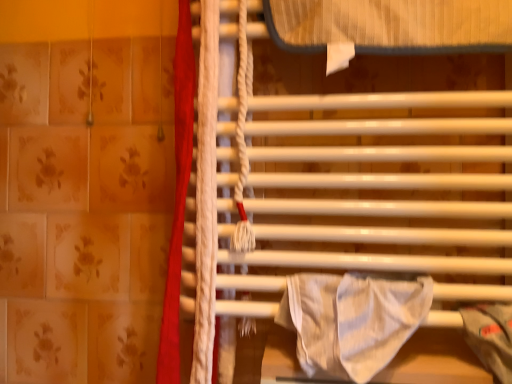
Question: Is white glossy towel rack at center positioned with its back to red fabric curtain at left?

Choices:
 (A) no
 (B) yes

Answer: (A)

Question: Can red fabric curtain at left be found inside white glossy towel rack at center?

Choices:
 (A) no
 (B) yes

Answer: (B)

Question: Is white glossy towel rack at center not inside red fabric curtain at left?

Choices:
 (A) no
 (B) yes

Answer: (B)

Question: Considering the relative sizes of white glossy towel rack at center and red fabric curtain at left in the image provided, is white glossy towel rack at center taller than red fabric curtain at left?

Choices:
 (A) yes
 (B) no

Answer: (B)

Question: Does white glossy towel rack at center appear on the right side of red fabric curtain at left?

Choices:
 (A) no
 (B) yes

Answer: (B)

Question: Considering the relative sizes of white glossy towel rack at center and red fabric curtain at left in the image provided, is white glossy towel rack at center thinner than red fabric curtain at left?

Choices:
 (A) no
 (B) yes

Answer: (A)

Question: Can you confirm if white glossy towel rack at center is positioned to the right of white striped fabric at center?

Choices:
 (A) yes
 (B) no

Answer: (A)

Question: From the image's perspective, is white glossy towel rack at center beneath white striped fabric at center?

Choices:
 (A) yes
 (B) no

Answer: (B)

Question: Is white glossy towel rack at center closer to the viewer compared to white striped fabric at center?

Choices:
 (A) yes
 (B) no

Answer: (B)

Question: From the image's perspective, is white glossy towel rack at center located above white striped fabric at center?

Choices:
 (A) yes
 (B) no

Answer: (A)

Question: Can you confirm if white glossy towel rack at center is wider than white striped fabric at center?

Choices:
 (A) yes
 (B) no

Answer: (A)

Question: Would you say white striped fabric at center is part of white glossy towel rack at center's contents?

Choices:
 (A) yes
 (B) no

Answer: (B)

Question: Is red fabric curtain at left with white glossy towel rack at center?

Choices:
 (A) no
 (B) yes

Answer: (A)